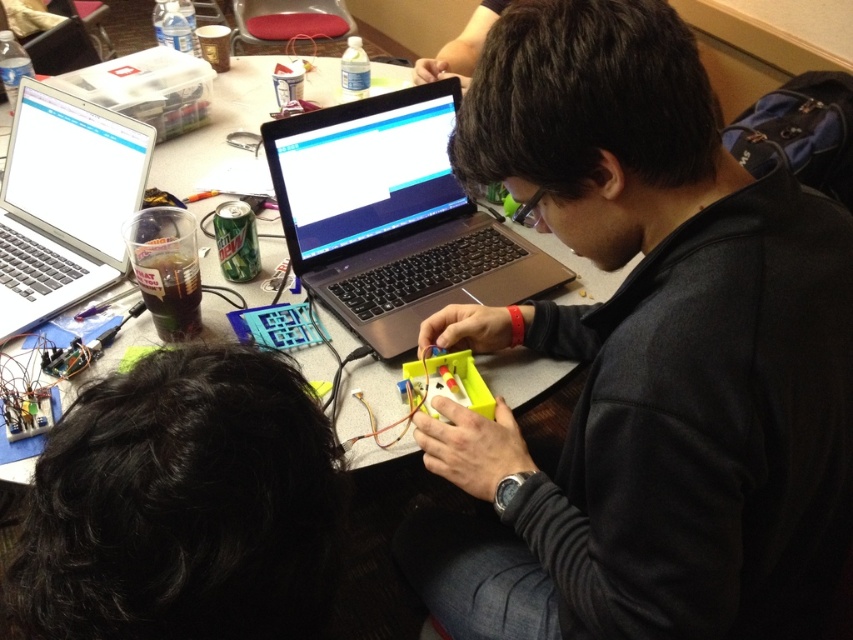
Does black hair at upper center have a smaller size compared to matte plastic table at center?

Yes, black hair at upper center is smaller than matte plastic table at center.

Does black hair at upper center have a greater width compared to matte plastic table at center?

No, black hair at upper center is not wider than matte plastic table at center.

Between point (129, 396) and point (30, 464), which one is positioned behind?

Point (30, 464)

What are the coordinates of `black hair at upper center` in the screenshot? It's located at (183, 506).

Is black matte laptop at center shorter than silver metallic laptop at upper left?

In fact, black matte laptop at center may be taller than silver metallic laptop at upper left.

Does black matte laptop at center have a greater height compared to silver metallic laptop at upper left?

Correct, black matte laptop at center is much taller as silver metallic laptop at upper left.

Where is `black matte laptop at center`? The image size is (853, 640). black matte laptop at center is located at coordinates (643, 356).

This screenshot has width=853, height=640. What are the coordinates of `black matte laptop at center` in the screenshot? It's located at [x=643, y=356].

Does black matte laptop at center have a lesser width compared to silver metallic laptop at center?

Yes, black matte laptop at center is thinner than silver metallic laptop at center.

Which of these two, black matte laptop at center or silver metallic laptop at center, stands taller?

black matte laptop at center

Describe the element at coordinates (643, 356) in the screenshot. The height and width of the screenshot is (640, 853). I see `black matte laptop at center` at that location.

You are a GUI agent. You are given a task and a screenshot of the screen. Output one action in this format:
    pyautogui.click(x=<x>, y=<y>)
    Task: Click on the black matte laptop at center
    The image size is (853, 640).
    Given the screenshot: What is the action you would take?
    pyautogui.click(x=643, y=356)